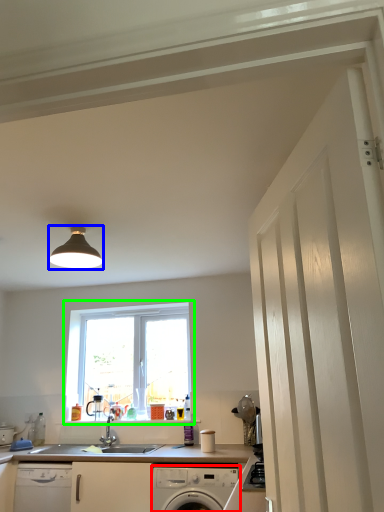
Question: Based on their relative distances, which object is farther from home appliance (highlighted by a red box)? Choose from light fixture (highlighted by a blue box) and window (highlighted by a green box).

Choices:
 (A) light fixture
 (B) window

Answer: (A)